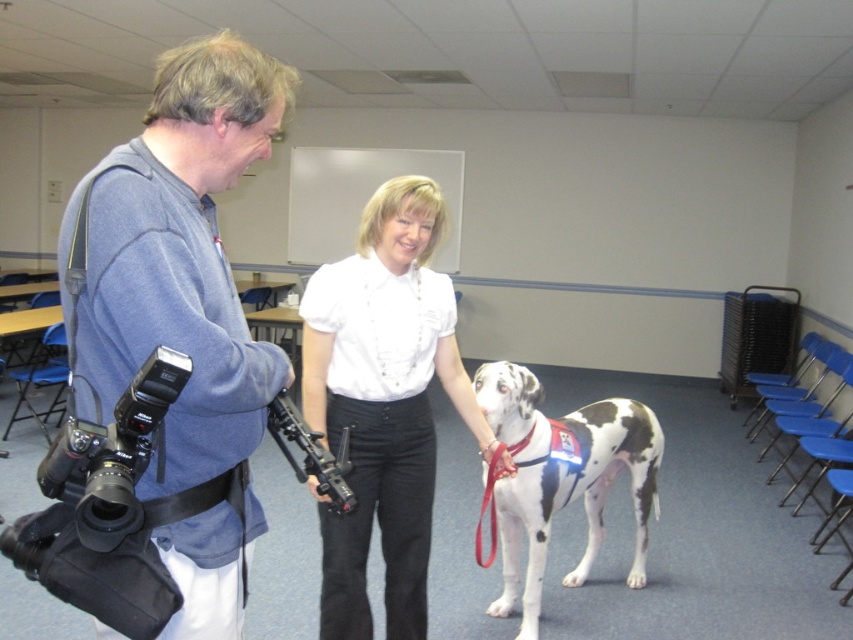
What is located at the point with coordinates (383, 403) in the image?

The point at coordinates (383, 403) corresponds to the white smooth shirt at center.

You are organizing a photo shoot in the classroom. You have two subjects to photograph, the white smooth shirt at center and the spotted fur dog at center. Since you want to ensure both are visible in the frame, which subject should you focus on first to accommodate their size?

You should focus on the spotted fur dog at center first because it occupies more space than the white smooth shirt at center, so you need to ensure it fits properly before adjusting the frame for the smaller subject.